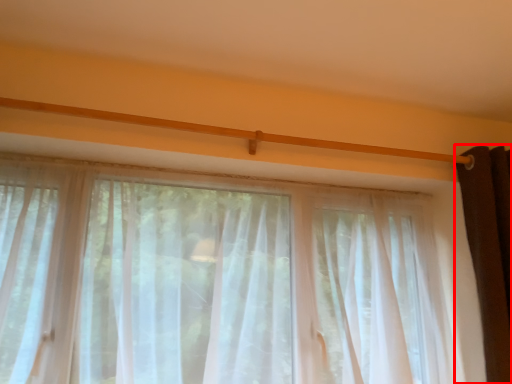
Question: Where is curtain (annotated by the red box) located in relation to curtain in the image?

Choices:
 (A) right
 (B) left

Answer: (A)